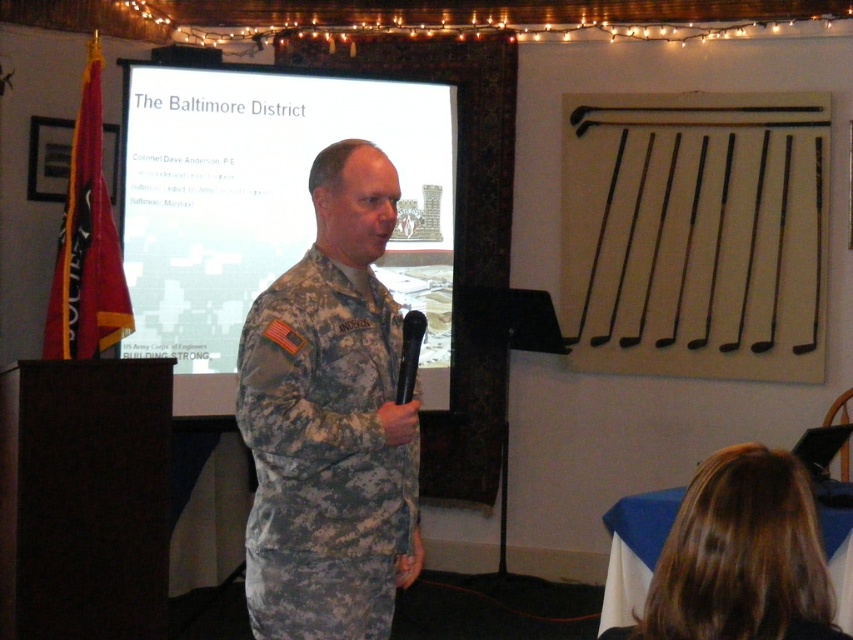
Looking at this image, which is above, white matte projection screen at center or camouflage uniform at center?

Positioned higher is white matte projection screen at center.

Can you confirm if white matte projection screen at center is positioned above camouflage uniform at center?

Yes, white matte projection screen at center is above camouflage uniform at center.

Is point (268, 136) positioned before point (701, 515)?

No, (268, 136) is behind (701, 515).

Identify the location of white matte projection screen at center. This screenshot has width=853, height=640. (268, 198).

Between camouflage fabric uniform at center and camouflage uniform at center, which one appears on the left side from the viewer's perspective?

camouflage fabric uniform at center

Is camouflage fabric uniform at center smaller than camouflage uniform at center?

No.

Who is more distant from viewer, (x=328, y=584) or (x=791, y=547)?

The point (x=328, y=584) is behind.

Where is `camouflage fabric uniform at center`? camouflage fabric uniform at center is located at coordinates 323,456.

Which is below, white matte projection screen at center or camouflage fabric uniform at center?

camouflage fabric uniform at center is lower down.

Can you confirm if white matte projection screen at center is positioned to the right of camouflage fabric uniform at center?

In fact, white matte projection screen at center is to the left of camouflage fabric uniform at center.

Is point (190, 122) positioned in front of point (292, 324)?

No, it is behind (292, 324).

Image resolution: width=853 pixels, height=640 pixels. What are the coordinates of `white matte projection screen at center` in the screenshot? It's located at (268, 198).